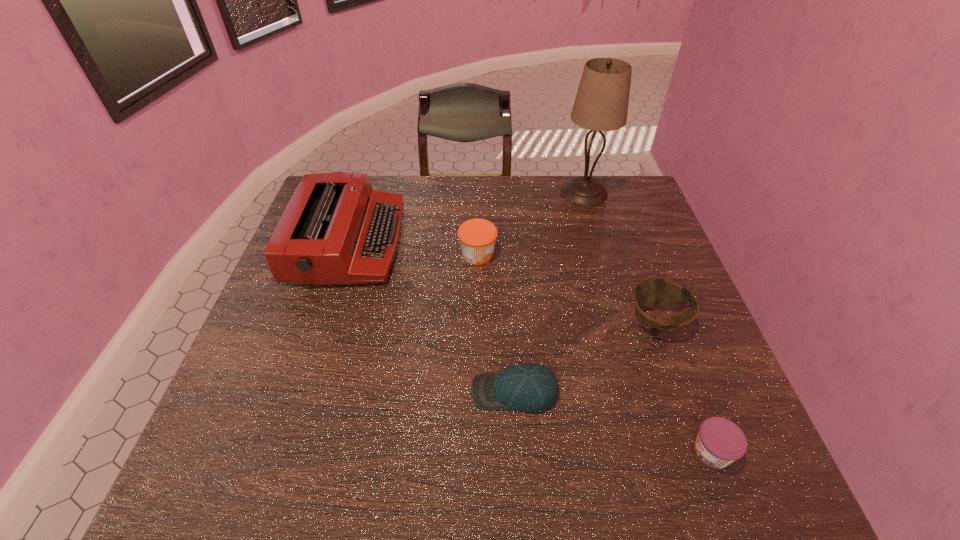
The height and width of the screenshot is (540, 960). I want to click on lampshade, so click(x=601, y=104).

Where is `typewriter`? The height and width of the screenshot is (540, 960). typewriter is located at coordinates (336, 229).

At what (x,y) coordinates should I click in order to perform the action: click on the leftmost object. Please return your answer as a coordinate pair (x, y). This screenshot has width=960, height=540. Looking at the image, I should click on tap(336, 229).

This screenshot has width=960, height=540. In order to click on the taller jam in this screenshot , I will do `click(477, 237)`.

I want to click on the left jam, so click(477, 237).

Locate an element on the screen. bowl is located at coordinates (650, 292).

This screenshot has width=960, height=540. I want to click on baseball cap, so click(530, 387).

Image resolution: width=960 pixels, height=540 pixels. In order to click on the shorter jam in this screenshot , I will do `click(719, 442)`.

Locate an element on the screen. Image resolution: width=960 pixels, height=540 pixels. the right jam is located at coordinates (719, 442).

Find the location of a particular element. This screenshot has width=960, height=540. blank space located on the front-facing side of the tallest object is located at coordinates (608, 274).